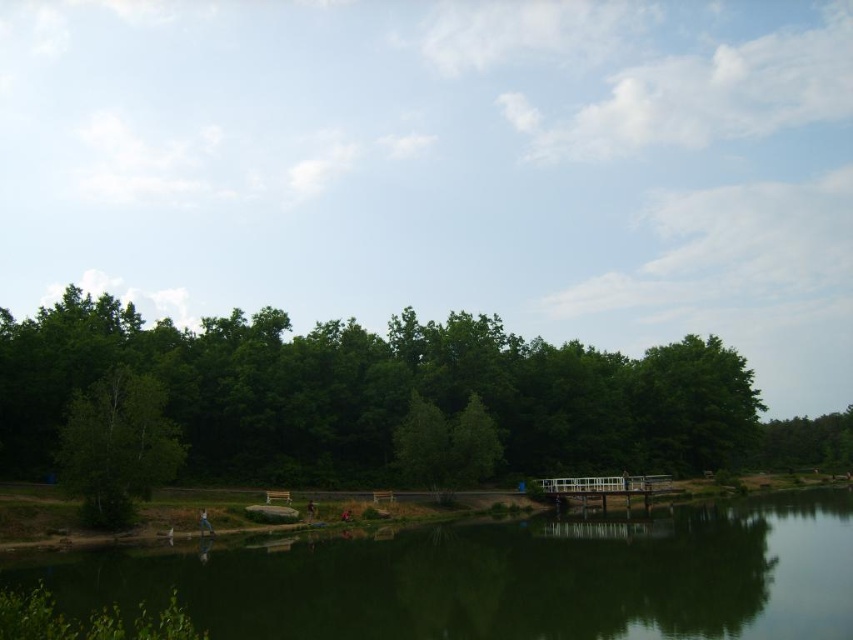
Question: Does green reflective water at lower center lie behind green matte tree at left?

Choices:
 (A) no
 (B) yes

Answer: (A)

Question: Does green reflective water at lower center appear over green matte tree at left?

Choices:
 (A) no
 (B) yes

Answer: (A)

Question: Which point is farther to the camera?

Choices:
 (A) green leafy trees at center
 (B) green reflective water at lower center

Answer: (A)

Question: Which object is positioned farthest from the green leafy trees at center?

Choices:
 (A) green matte tree at left
 (B) green reflective water at lower center

Answer: (B)

Question: Can you confirm if green reflective water at lower center is positioned to the right of green matte tree at left?

Choices:
 (A) no
 (B) yes

Answer: (B)

Question: Which point is farther to the camera?

Choices:
 (A) (173, 436)
 (B) (666, 540)
 (C) (344, 362)

Answer: (C)